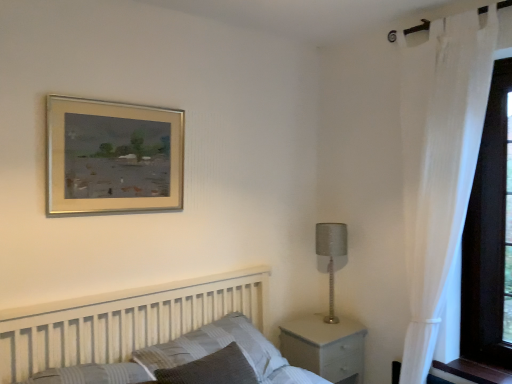
Question: Considering the relative sizes of satin silver lamp at right and gold metallic picture frame at upper center in the image provided, is satin silver lamp at right wider than gold metallic picture frame at upper center?

Choices:
 (A) no
 (B) yes

Answer: (B)

Question: Is gold metallic picture frame at upper center located within satin silver lamp at right?

Choices:
 (A) yes
 (B) no

Answer: (B)

Question: From a real-world perspective, is satin silver lamp at right on gold metallic picture frame at upper center?

Choices:
 (A) no
 (B) yes

Answer: (A)

Question: From a real-world perspective, is satin silver lamp at right physically below gold metallic picture frame at upper center?

Choices:
 (A) yes
 (B) no

Answer: (A)

Question: From the image's perspective, is satin silver lamp at right on gold metallic picture frame at upper center?

Choices:
 (A) no
 (B) yes

Answer: (A)

Question: Does satin silver lamp at right come in front of gold metallic picture frame at upper center?

Choices:
 (A) yes
 (B) no

Answer: (B)

Question: Does white sheer curtain at right have a greater height compared to white matte nightstand at lower right?

Choices:
 (A) no
 (B) yes

Answer: (B)

Question: Can you confirm if white sheer curtain at right is smaller than white matte nightstand at lower right?

Choices:
 (A) yes
 (B) no

Answer: (B)

Question: Can you confirm if white sheer curtain at right is positioned to the right of white matte nightstand at lower right?

Choices:
 (A) yes
 (B) no

Answer: (A)

Question: From a real-world perspective, is white sheer curtain at right positioned over white matte nightstand at lower right based on gravity?

Choices:
 (A) no
 (B) yes

Answer: (B)

Question: Is white sheer curtain at right shorter than white matte nightstand at lower right?

Choices:
 (A) yes
 (B) no

Answer: (B)

Question: From the image's perspective, is white sheer curtain at right beneath white matte nightstand at lower right?

Choices:
 (A) no
 (B) yes

Answer: (A)

Question: From a real-world perspective, is white wooden bed at lower left beneath striped fabric pillow at center?

Choices:
 (A) no
 (B) yes

Answer: (A)